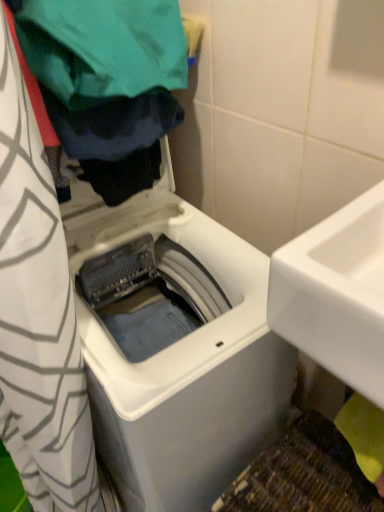
Question: From the image's perspective, is white glossy sink at right located above or below green fabric at upper left?

Choices:
 (A) above
 (B) below

Answer: (B)

Question: Is white glossy sink at right wider or thinner than green fabric at upper left?

Choices:
 (A) wide
 (B) thin

Answer: (A)

Question: Based on their relative distances, which object is nearer to the white plastic washing machine at center?

Choices:
 (A) green fabric at upper left
 (B) white glossy sink at right

Answer: (B)

Question: Which object is positioned closest to the white plastic washing machine at center?

Choices:
 (A) white glossy sink at right
 (B) green fabric at upper left

Answer: (A)